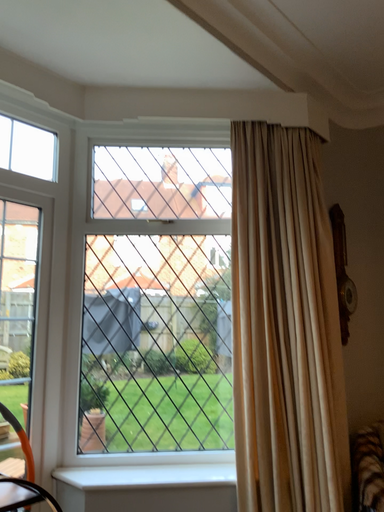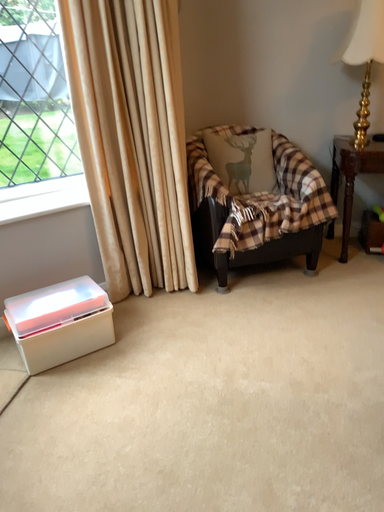
Question: How did the camera likely rotate when shooting the video?

Choices:
 (A) rotated right
 (B) rotated left

Answer: (A)